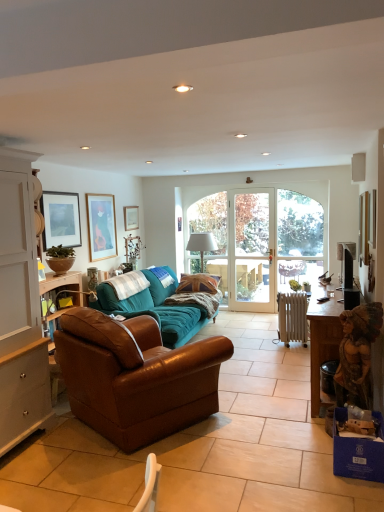
This screenshot has height=512, width=384. What do you see at coordinates (136, 377) in the screenshot? I see `brown leather couch at center, acting as the 2th studio couch starting from the back` at bounding box center [136, 377].

You are a GUI agent. You are given a task and a screenshot of the screen. Output one action in this format:
    pyautogui.click(x=<x>, y=<y>)
    Task: Click on the clear glass door at center
    Image resolution: width=384 pixels, height=512 pixels.
    Given the screenshot: What is the action you would take?
    pyautogui.click(x=213, y=237)

At what (x,y) coordinates should I click in order to perform the action: click on white plastic speaker at upper right. Please return your answer as a coordinate pair (x, y). The width and height of the screenshot is (384, 512). Looking at the image, I should click on (358, 167).

Image resolution: width=384 pixels, height=512 pixels. I want to click on clear glass door at center, so click(298, 238).

Describe the element at coordinates (323, 300) in the screenshot. I see `black plastic remote control at lower right` at that location.

Image resolution: width=384 pixels, height=512 pixels. Find the location of `teal fabric couch at center, the 2th studio couch positioned from the front`. teal fabric couch at center, the 2th studio couch positioned from the front is located at coordinates (155, 308).

Locate an element on the screen. brown leather couch at center, acting as the 2th studio couch starting from the back is located at coordinates (136, 377).

Could you tell me if white fabric lampshade at center is turned towards black glossy television at right?

No.

Based on their positions, is white fabric lampshade at center located to the left or right of black glossy television at right?

Clearly, white fabric lampshade at center is on the left of black glossy television at right in the image.

Which is closer to the camera, (x=214, y=246) or (x=348, y=243)?

Point (x=214, y=246) is positioned farther from the camera compared to point (x=348, y=243).

In the image, is teal fabric couch at center, the 2th studio couch positioned from the front, on the left side or the right side of clear glass door at center?

From the image, it's evident that teal fabric couch at center, the 2th studio couch positioned from the front, is to the left of clear glass door at center.

How different are the orientations of teal fabric couch at center, which is counted as the first studio couch, starting from the back, and clear glass door at center in degrees?

The facing directions of teal fabric couch at center, which is counted as the first studio couch, starting from the back, and clear glass door at center are 89.4 degrees apart.

Is point (196, 307) positioned behind point (262, 243)?

That is False.

Measure the distance from teal fabric couch at center, the 2th studio couch positioned from the front, to clear glass door at center.

teal fabric couch at center, the 2th studio couch positioned from the front, and clear glass door at center are 1.75 meters apart from each other.

From the image's perspective, does black glossy television at right appear higher than white fabric lampshade at center?

No, from the image's perspective, black glossy television at right is not above white fabric lampshade at center.

Does black glossy television at right have a lesser height compared to white fabric lampshade at center?

Indeed, black glossy television at right has a lesser height compared to white fabric lampshade at center.

From a real-world perspective, which object rests below the other?

From a 3D spatial view, white fabric lampshade at center is below.

Is black glossy television at right to the right of white fabric lampshade at center from the viewer's perspective?

Correct, you'll find black glossy television at right to the right of white fabric lampshade at center.

Is clear glass door at center outside of teal fabric couch at center, the 2th studio couch positioned from the front?

clear glass door at center is positioned outside teal fabric couch at center, the 2th studio couch positioned from the front.

In the image, is clear glass door at center positioned in front of or behind teal fabric couch at center, the 2th studio couch positioned from the front?

In the image, clear glass door at center appears behind teal fabric couch at center, the 2th studio couch positioned from the front.

In the scene shown: Considering the sizes of objects clear glass door at center and teal fabric couch at center, which is counted as the first studio couch, starting from the back, in the image provided, who is smaller, clear glass door at center or teal fabric couch at center, which is counted as the first studio couch, starting from the back,?

Smaller between the two is clear glass door at center.

From the picture: Considering the sizes of objects clear glass door at center and teal fabric couch at center, which is counted as the first studio couch, starting from the back, in the image provided, who is taller, clear glass door at center or teal fabric couch at center, which is counted as the first studio couch, starting from the back,?

Standing taller between the two is clear glass door at center.

Which of these two, matte wooden picture frame at upper center, which ranks as the first picture frame in back-to-front order, or white fabric lampshade at center, is wider?

white fabric lampshade at center.

From a real-world perspective, is matte wooden picture frame at upper center, arranged as the fourth picture frame when viewed from the front, on top of white fabric lampshade at center?

Correct, in the physical world, matte wooden picture frame at upper center, arranged as the fourth picture frame when viewed from the front, is higher than white fabric lampshade at center.

From the image's perspective, is matte wooden picture frame at upper center, which is the 3th picture frame from left to right, located beneath white fabric lampshade at center?

No.

Is matte wooden picture frame at upper center, which is the 3th picture frame from left to right, behind white fabric lampshade at center?

Yes, the depth of matte wooden picture frame at upper center, which is the 3th picture frame from left to right, is greater than that of white fabric lampshade at center.

Which object is wider, brown leather couch at center, which is the 1th studio couch from front to back, or wooden statue at right?

Wider between the two is brown leather couch at center, which is the 1th studio couch from front to back.

How different are the orientations of brown leather couch at center, acting as the 2th studio couch starting from the back, and wooden statue at right in degrees?

121 degrees separate the facing orientations of brown leather couch at center, acting as the 2th studio couch starting from the back, and wooden statue at right.

In the image, is brown leather couch at center, acting as the 2th studio couch starting from the back, positioned in front of or behind wooden statue at right?

brown leather couch at center, acting as the 2th studio couch starting from the back, is positioned closer to the viewer than wooden statue at right.

From the image's perspective, would you say brown leather couch at center, acting as the 2th studio couch starting from the back, is positioned over wooden statue at right?

Incorrect, from the image's perspective, brown leather couch at center, acting as the 2th studio couch starting from the back, is lower than wooden statue at right.

The image size is (384, 512). I want to click on television in front of the clear glass door at center, so click(x=346, y=262).

Which is closer, (222,284) or (349,280)?

The point (349,280) is more forward.

Considering the relative sizes of clear glass door at center and black glossy television at right in the image provided, is clear glass door at center thinner than black glossy television at right?

Correct, the width of clear glass door at center is less than that of black glossy television at right.

Is clear glass door at center in contact with black glossy television at right?

There is a gap between clear glass door at center and black glossy television at right.

Where is `lamp behind the black glossy television at right`? This screenshot has width=384, height=512. lamp behind the black glossy television at right is located at coordinates (201, 243).

From the image's perspective, starting from the clear glass door at center, which studio couch is the 1st one below? Please provide its 2D coordinates.

[(155, 308)]

Estimate the real-world distances between objects in this image. Which object is further from green matte bowl at left, teal fabric couch at center, which is counted as the first studio couch, starting from the back, or white plastic speaker at upper right?

white plastic speaker at upper right is positioned further to the anchor green matte bowl at left.

From the image, which object appears to be nearer to white fabric lampshade at center, black plastic remote control at lower right or white plastic speaker at upper right?

white plastic speaker at upper right is positioned closer to the anchor white fabric lampshade at center.

Based on their spatial positions, is clear glass door at center or white wood cabinet at left closer to clear glass door at center?

Based on the image, clear glass door at center appears to be nearer to clear glass door at center.

Considering their positions, is clear glass door at center positioned closer to matte wooden picture frame at upper center, which ranks as the first picture frame in back-to-front order, than black glossy television at right?

clear glass door at center is positioned closer to the anchor matte wooden picture frame at upper center, which ranks as the first picture frame in back-to-front order.

Estimate the real-world distances between objects in this image. Which object is closer to brown leather couch at center, acting as the 2th studio couch starting from the back, green matte bowl at left or white wood cabinet at left?

Based on the image, white wood cabinet at left appears to be nearer to brown leather couch at center, acting as the 2th studio couch starting from the back.

Looking at the image, which one is located further to clear glass door at center, black plastic remote control at lower right or metallic silver picture frame at upper right, placed as the first picture frame when sorted from front to back?

black plastic remote control at lower right lies further to clear glass door at center than the other object.

Considering their positions, is gold-framed picture at upper left, the third picture frame positioned from the front, positioned closer to wooden statue at right than clear glass door at center?

Among the two, gold-framed picture at upper left, the third picture frame positioned from the front, is located nearer to wooden statue at right.

From the image, which object appears to be nearer to teal fabric couch at center, which is counted as the first studio couch, starting from the back, brown leather couch at center, which is the 1th studio couch from front to back, or white fabric lampshade at center?

Based on the image, brown leather couch at center, which is the 1th studio couch from front to back, appears to be nearer to teal fabric couch at center, which is counted as the first studio couch, starting from the back.

Where is `glass door between brown leather couch at center, which is the 1th studio couch from front to back, and clear glass door at center in the front-back direction`? This screenshot has height=512, width=384. glass door between brown leather couch at center, which is the 1th studio couch from front to back, and clear glass door at center in the front-back direction is located at coordinates (298, 238).

This screenshot has width=384, height=512. In order to click on glass door located between wooden statue at right and clear glass door at center in the depth direction in this screenshot , I will do `click(298, 238)`.

Identify the location of loudspeaker located between black glossy television at right and clear glass door at center in the depth direction. The image size is (384, 512). (358, 167).

Where is `loudspeaker between wooden statue at right and white fabric lampshade at center from front to back`? loudspeaker between wooden statue at right and white fabric lampshade at center from front to back is located at coordinates (358, 167).